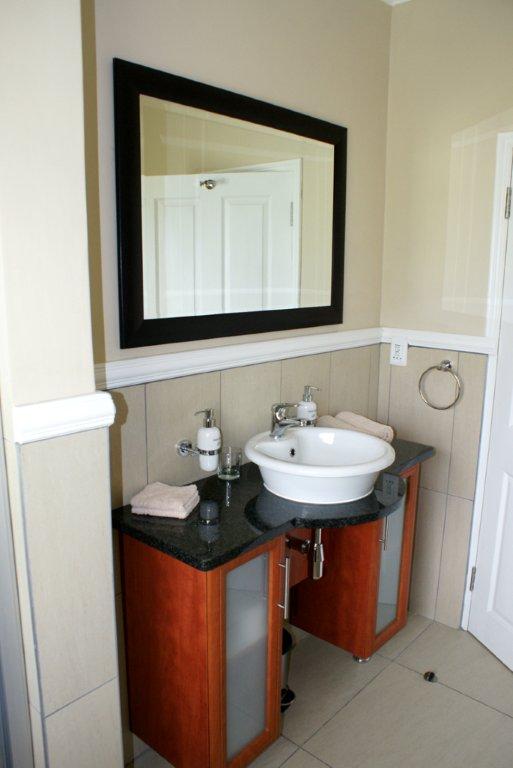
At what (x,y) coordinates should I click in order to perform the action: click on wall. Please return your answer as a coordinate pair (x, y). This screenshot has width=513, height=768. Looking at the image, I should click on (416, 81).